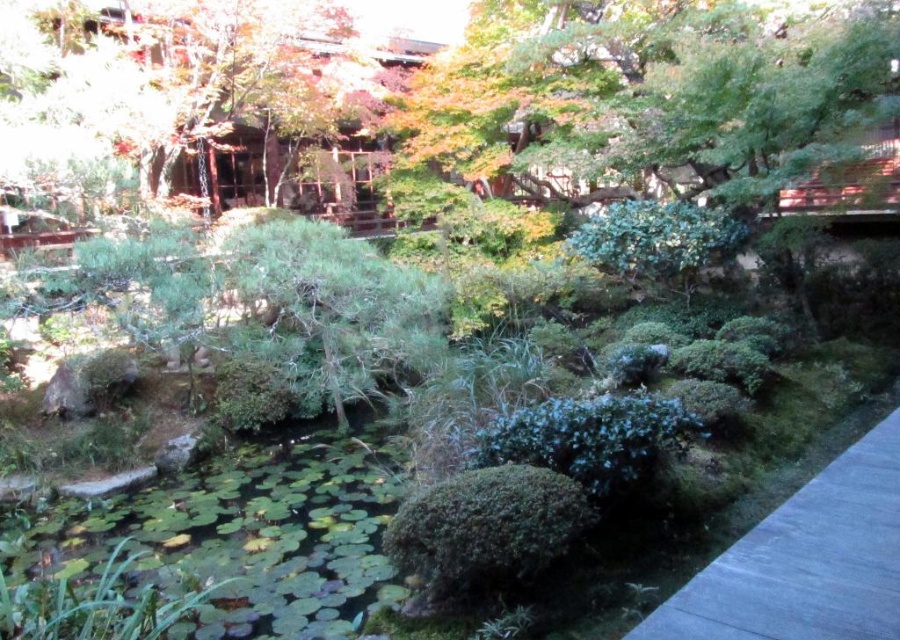
Question: From the image, what is the correct spatial relationship of gray concrete path at lower right in relation to green mossy bush at center?

Choices:
 (A) below
 (B) above

Answer: (B)

Question: Which point is closer to the camera taking this photo?

Choices:
 (A) 450,515
 (B) 621,472

Answer: (A)

Question: Which of these objects is positioned farthest from the green mossy bush at center?

Choices:
 (A) green leafy bush at center
 (B) green leafy pond at lower left
 (C) green matte bush at center
 (D) gray concrete path at lower right

Answer: (A)

Question: Can you confirm if gray concrete path at lower right is bigger than green leafy bush at center?

Choices:
 (A) no
 (B) yes

Answer: (A)

Question: Is gray concrete path at lower right behind green matte bush at center?

Choices:
 (A) no
 (B) yes

Answer: (A)

Question: Which is nearer to the green leafy bush at center?

Choices:
 (A) green mossy bush at center
 (B) green matte bush at center

Answer: (B)